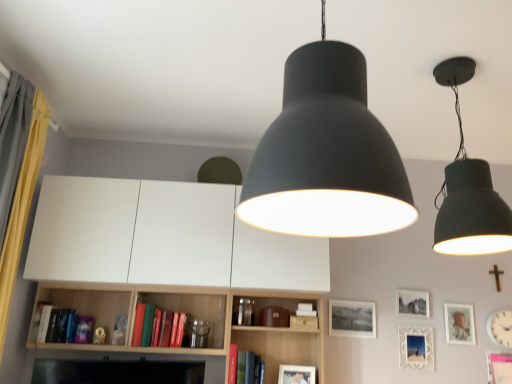
What is the approximate height of matte black picture frame at center, which appears as the 2th picture frame when viewed from the left?

24.65 centimeters.

Find the location of a particular element. white textured picture frame at lower right, the third picture frame positioned from the left is located at coordinates (416, 348).

Describe the element at coordinates (416, 348) in the screenshot. I see `white textured picture frame at lower right, which is the third picture frame from right to left` at that location.

What is the approximate width of matte black lampshade at upper right, the 1th lamp viewed from the back?

15.64 inches.

This screenshot has width=512, height=384. What are the coordinates of `matte black lampshade at upper right, the second lamp viewed from the front` in the screenshot? It's located at (468, 189).

Looking at this image, in order to face wooden cross at upper right, should I rotate leftwards or rightwards?

You should look right and rotate roughly 29.708 degrees.

Describe the element at coordinates (500, 327) in the screenshot. Image resolution: width=512 pixels, height=384 pixels. I see `white plastic clock at lower right` at that location.

The height and width of the screenshot is (384, 512). I want to click on matte black picture frame at center, positioned as the 4th picture frame in right-to-left order, so click(352, 318).

Considering the sizes of objects matte black picture frame at center, positioned as the 4th picture frame in right-to-left order, and matte black lampshade at center, the 1th lamp in the front-to-back sequence, in the image provided, who is taller, matte black picture frame at center, positioned as the 4th picture frame in right-to-left order, or matte black lampshade at center, the 1th lamp in the front-to-back sequence,?

Standing taller between the two is matte black lampshade at center, the 1th lamp in the front-to-back sequence.

How many degrees apart are the facing directions of matte black picture frame at center, positioned as the 4th picture frame in right-to-left order, and matte black lampshade at center, the 1th lamp in the front-to-back sequence?

The angle between the facing direction of matte black picture frame at center, positioned as the 4th picture frame in right-to-left order, and the facing direction of matte black lampshade at center, the 1th lamp in the front-to-back sequence, is 1.17 degrees.

Can you confirm if matte black picture frame at center, which appears as the 2th picture frame when viewed from the left, is bigger than matte black lampshade at center, acting as the 2th lamp starting from the right?

No.

Can you confirm if matte black picture frame at center, which appears as the 2th picture frame when viewed from the left, is positioned to the left of matte black lampshade at center, arranged as the first lamp when viewed from the left?

No, matte black picture frame at center, which appears as the 2th picture frame when viewed from the left, is not to the left of matte black lampshade at center, arranged as the first lamp when viewed from the left.

Is hardcover book at center, the 1th book in the bottom-to-top sequence, directly adjacent to matte black lampshade at upper right, the 1th lamp viewed from the back?

No, hardcover book at center, the 1th book in the bottom-to-top sequence, is not beside matte black lampshade at upper right, the 1th lamp viewed from the back.

Would you say hardcover book at center, the 1th book in the right-to-left sequence, contains matte black lampshade at upper right, marked as the first lamp in a right-to-left arrangement?

No, hardcover book at center, the 1th book in the right-to-left sequence, does not contain matte black lampshade at upper right, marked as the first lamp in a right-to-left arrangement.

Is point (250, 370) positioned before point (464, 167)?

No.

Looking at this image, from the image's perspective, which one is positioned higher, hardcover book at center, the second book positioned from the left, or matte black lampshade at upper right, the second lamp viewed from the front?

matte black lampshade at upper right, the second lamp viewed from the front, appears higher in the image.

From a real-world perspective, who is located lower, wooden cross at upper right or matte gold picture frame at upper right, the 5th picture frame positioned from the left?

matte gold picture frame at upper right, the 5th picture frame positioned from the left, from a real-world perspective.

Are wooden cross at upper right and matte gold picture frame at upper right, the 5th picture frame positioned from the left, making contact?

There is a gap between wooden cross at upper right and matte gold picture frame at upper right, the 5th picture frame positioned from the left.

Considering the sizes of objects wooden cross at upper right and matte gold picture frame at upper right, the 5th picture frame positioned from the left, in the image provided, who is shorter, wooden cross at upper right or matte gold picture frame at upper right, the 5th picture frame positioned from the left,?

With less height is wooden cross at upper right.

Is white matte cabinet at upper center oriented away from hardcover book at lower left, which is the 1th book from top to bottom?

white matte cabinet at upper center does not have its back to hardcover book at lower left, which is the 1th book from top to bottom.

Between white matte cabinet at upper center and hardcover book at lower left, the 2th book positioned from the bottom, which one is positioned behind?

hardcover book at lower left, the 2th book positioned from the bottom, is further from the camera.

Where is `the 2nd book behind the white matte cabinet at upper center`? The width and height of the screenshot is (512, 384). the 2nd book behind the white matte cabinet at upper center is located at coordinates (64, 326).

Which is behind, yellow fabric curtain at left or matte black lampshade at center, acting as the 2th lamp starting from the right?

yellow fabric curtain at left is further away from the camera.

Considering the relative positions of yellow fabric curtain at left and matte black lampshade at center, the 1th lamp in the front-to-back sequence, in the image provided, is yellow fabric curtain at left to the right of matte black lampshade at center, the 1th lamp in the front-to-back sequence, from the viewer's perspective?

No.

Which is behind, point (20, 244) or point (371, 155)?

The point (20, 244) is behind.

Is hardcover book at center, the 1th book in the bottom-to-top sequence, beside white matte picture frame at lower center, the 1th picture frame in the left-to-right sequence?

There is a gap between hardcover book at center, the 1th book in the bottom-to-top sequence, and white matte picture frame at lower center, the 1th picture frame in the left-to-right sequence.

From the image's perspective, is hardcover book at center, the 1th book in the right-to-left sequence, located beneath white matte picture frame at lower center, the 1th picture frame in the left-to-right sequence?

No, from the image's perspective, hardcover book at center, the 1th book in the right-to-left sequence, is not below white matte picture frame at lower center, the 1th picture frame in the left-to-right sequence.

Is hardcover book at center, which is counted as the 2th book, starting from the top, facing towards white matte picture frame at lower center, arranged as the 5th picture frame when viewed from the right?

No, hardcover book at center, which is counted as the 2th book, starting from the top, is not oriented towards white matte picture frame at lower center, arranged as the 5th picture frame when viewed from the right.

Is white matte picture frame at lower center, arranged as the 5th picture frame when viewed from the right, thinner than yellow fabric curtain at left?

Yes.

Identify the location of curtain positioned vertically above the white matte picture frame at lower center, arranged as the 5th picture frame when viewed from the right (from a real-world perspective). (21, 204).

Is white matte picture frame at lower center, arranged as the 5th picture frame when viewed from the right, with yellow fabric curtain at left?

They are not placed beside each other.

Considering the sizes of objects white matte picture frame at lower center, the 1th picture frame in the left-to-right sequence, and yellow fabric curtain at left in the image provided, who is taller, white matte picture frame at lower center, the 1th picture frame in the left-to-right sequence, or yellow fabric curtain at left?

Standing taller between the two is yellow fabric curtain at left.

The image size is (512, 384). I want to click on the 2nd picture frame directly beneath the matte black lampshade at center, acting as the 2th lamp starting from the right (from a real-world perspective), so click(x=352, y=318).

From the image's perspective, which book is the 2nd one below the matte black lampshade at upper right, the 1th lamp viewed from the back? Please provide its 2D coordinates.

[(243, 367)]

Based on their spatial positions, is hardcover book at center, the 1th book in the bottom-to-top sequence, or hardcover book at lower left, the 1th book when ordered from left to right, further from matte black lampshade at center, arranged as the first lamp when viewed from the left?

The object further to matte black lampshade at center, arranged as the first lamp when viewed from the left, is hardcover book at lower left, the 1th book when ordered from left to right.

When comparing their distances from matte black picture frame at center, which appears as the 2th picture frame when viewed from the left, does hardcover book at lower left, which is the 1th book from top to bottom, or yellow fabric curtain at left seem further?

yellow fabric curtain at left is further to matte black picture frame at center, which appears as the 2th picture frame when viewed from the left.

Based on their spatial positions, is white matte cabinet at upper center or hardcover book at lower left, the 2th book positioned from the bottom, closer to yellow fabric curtain at left?

Based on the image, hardcover book at lower left, the 2th book positioned from the bottom, appears to be nearer to yellow fabric curtain at left.

From the image, which object appears to be nearer to wooden cross at upper right, hardcover book at lower left, which is the 1th book from top to bottom, or white plastic clock at lower right?

white plastic clock at lower right.

When comparing their distances from matte black lampshade at upper right, the 1th lamp viewed from the back, does white matte picture frame at lower center, arranged as the 5th picture frame when viewed from the right, or wooden cross at upper right seem closer?

wooden cross at upper right is positioned closer to the anchor matte black lampshade at upper right, the 1th lamp viewed from the back.

Looking at this image, which object lies further to the anchor point matte black lampshade at upper right, the second lamp viewed from the front, white matte picture frame at lower center, arranged as the 5th picture frame when viewed from the right, or white plastic clock at lower right?

Among the two, white matte picture frame at lower center, arranged as the 5th picture frame when viewed from the right, is located further to matte black lampshade at upper right, the second lamp viewed from the front.

Based on their spatial positions, is yellow fabric curtain at left or white plastic clock at lower right further from wooden cross at upper right?

yellow fabric curtain at left.

Which object lies nearer to the anchor point white matte cabinet at upper center, matte black lampshade at center, the 1th lamp in the front-to-back sequence, or white textured picture frame at lower right, which is the third picture frame from right to left?

white textured picture frame at lower right, which is the third picture frame from right to left, is closer to white matte cabinet at upper center.

Where is `entertainment center between yellow fabric curtain at left and matte black picture frame at center-right, which is the second picture frame from right to left, from left to right`? The height and width of the screenshot is (384, 512). entertainment center between yellow fabric curtain at left and matte black picture frame at center-right, which is the second picture frame from right to left, from left to right is located at coordinates (170, 263).

Where is `entertainment center located between yellow fabric curtain at left and matte gold picture frame at upper right, placed as the first picture frame when sorted from right to left, in the left-right direction`? The width and height of the screenshot is (512, 384). entertainment center located between yellow fabric curtain at left and matte gold picture frame at upper right, placed as the first picture frame when sorted from right to left, in the left-right direction is located at coordinates (170, 263).

Identify the location of crucifix located between matte gold picture frame at upper right, the 5th picture frame positioned from the left, and white plastic clock at lower right in the left-right direction. The image size is (512, 384). (496, 276).

Locate an element on the screen. picture frame located between yellow fabric curtain at left and matte black picture frame at center, positioned as the 4th picture frame in right-to-left order, in the left-right direction is located at coordinates (296, 374).